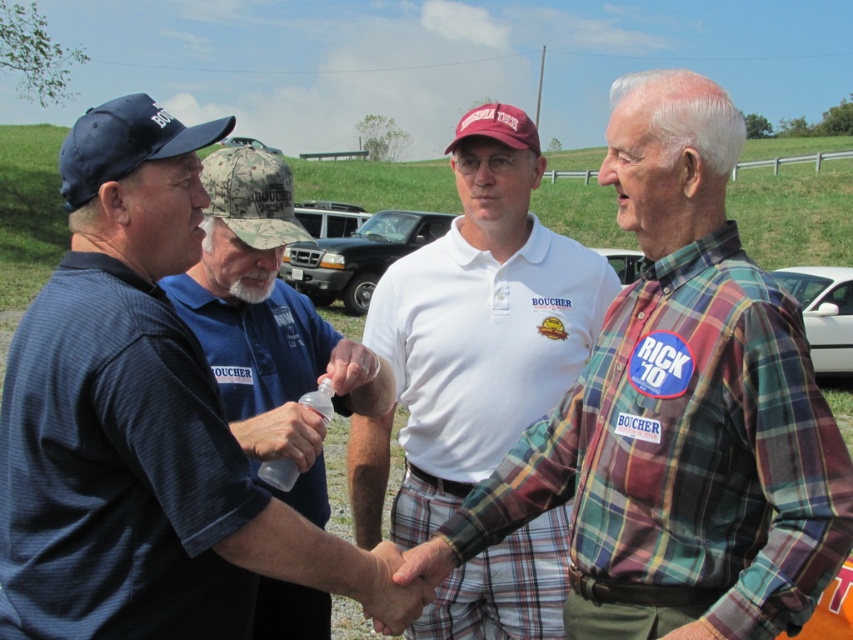
You are a photographer trying to capture a clear shot of both the white cotton polo shirt at center and the white plastic car at center. Since they are both at the center, which one is closer to the left side of the frame?

The white cotton polo shirt at center is to the left of the white plastic car at center, so it is closer to the left side of the frame.

Based on the photo, you are a photographer who needs to adjust the camera focus to capture both the white cotton shirt at center and the blue striped shirt at left clearly. Since the shirts are at different heights, which shirt should you focus on first to ensure both are in focus?

The white cotton shirt at center is taller than the blue striped shirt at left. To ensure both are in focus, focus on the white cotton shirt at center first, as it is the taller one, and adjust the depth of field to include the shorter blue striped shirt at left.